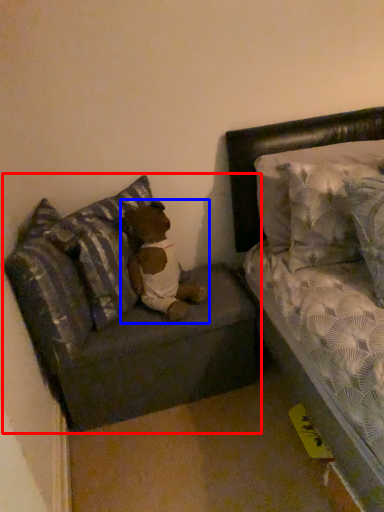
Question: Which of the following is the farthest to the observer, studio couch (highlighted by a red box) or teddy (highlighted by a blue box)?

Choices:
 (A) studio couch
 (B) teddy

Answer: (A)